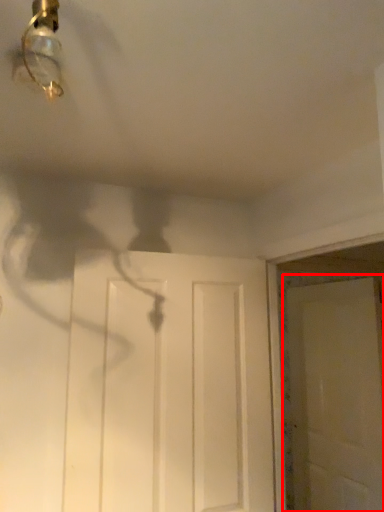
Question: From the image's perspective, where is door (annotated by the red box) located in relation to door in the image?

Choices:
 (A) below
 (B) above

Answer: (A)